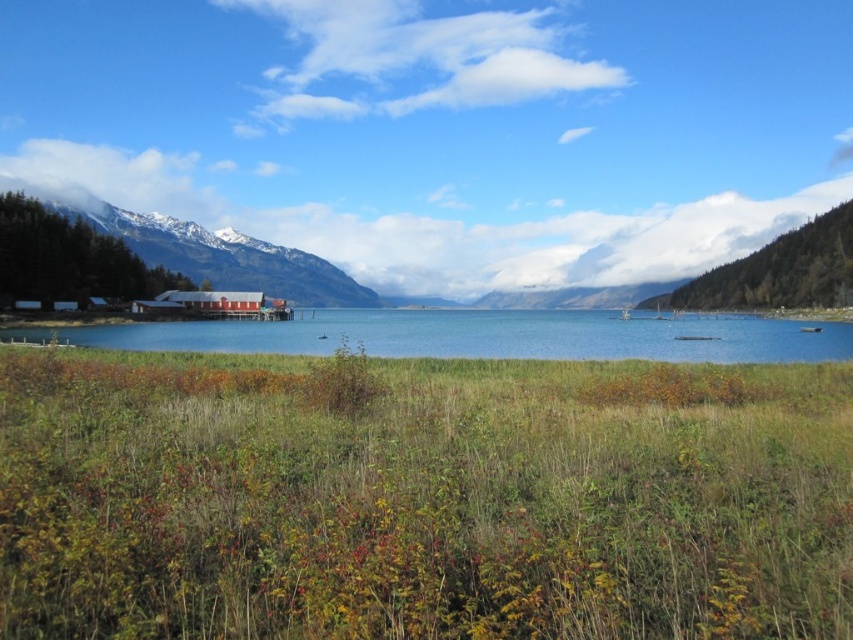
From the picture: You are standing at the point marked by the coordinate point at point (480,336). What is the color of the surface you are currently standing on?

The surface you are standing on is blue water at center, as the point (480,336) corresponds to the blue water at center.

You are standing in the field of grass and vegetation in the foreground of the scene. You want to walk to the blue water at center and then to the snowy mountain at left. Which direction should you walk first from your current position?

You should first walk to the right towards the blue water at center since it is located to the right of the snowy mountain at left. After reaching the blue water at center, you would then need to walk to the left to reach the snowy mountain at left.

Based on the scene description, which object occupies a lower vertical position in the image? Please consider the blue water at center and the snowy mountain at left.

The blue water at center has a lesser height compared to the snowy mountain at left, so the blue water at center is lower in the image.